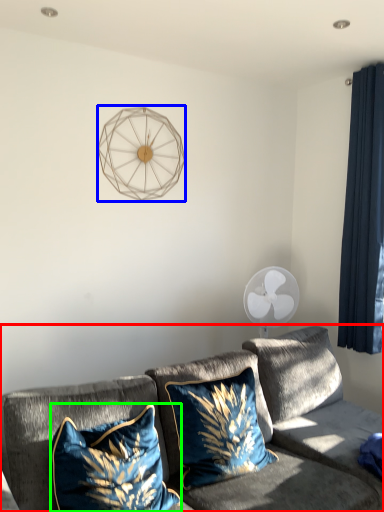
Question: Which object is positioned farthest from studio couch (highlighted by a red box)? Select from lamp (highlighted by a blue box) and pillow (highlighted by a green box).

Choices:
 (A) lamp
 (B) pillow

Answer: (A)